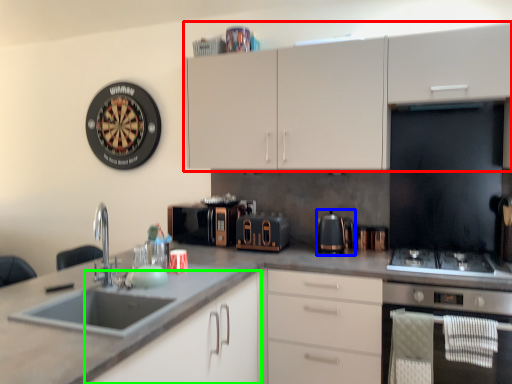
Question: Estimate the real-world distances between objects in this image. Which object is farther from cabinetry (highlighted by a red box), kitchen appliance (highlighted by a blue box) or cabinetry (highlighted by a green box)?

Choices:
 (A) kitchen appliance
 (B) cabinetry

Answer: (B)